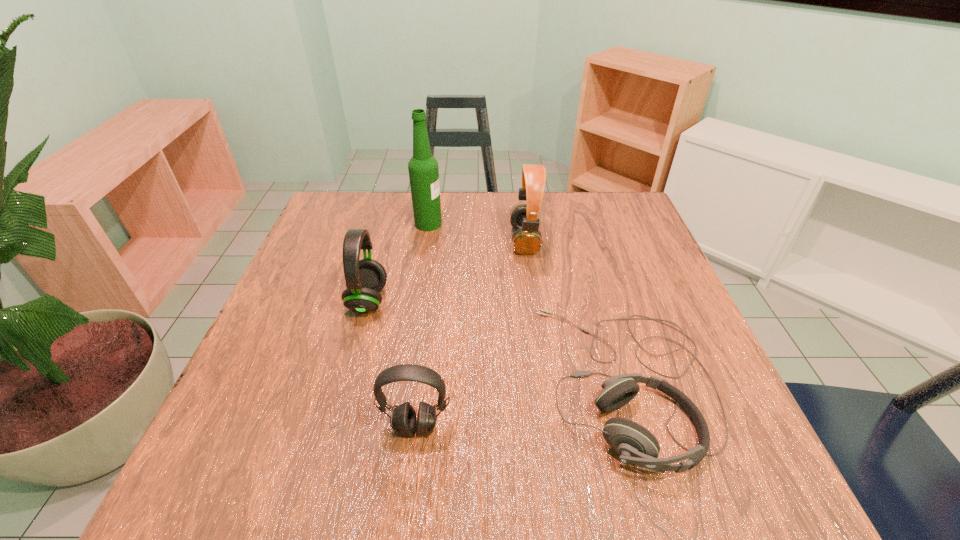
The height and width of the screenshot is (540, 960). What are the coordinates of `vacant space that satisfies the following two spatial constraints: 1. on the outer surface of the shortest object; 2. on the front-facing side of the second shortest headset` in the screenshot? It's located at click(642, 427).